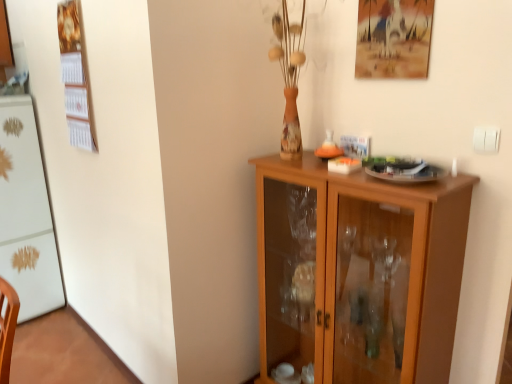
Question: From a real-world perspective, is white glossy refrigerator at left over wooden cabinet at center?

Choices:
 (A) yes
 (B) no

Answer: (A)

Question: From the image's perspective, is white glossy refrigerator at left located beneath wooden cabinet at center?

Choices:
 (A) no
 (B) yes

Answer: (A)

Question: Does white glossy refrigerator at left appear on the right side of wooden cabinet at center?

Choices:
 (A) no
 (B) yes

Answer: (A)

Question: Does white glossy refrigerator at left appear on the left side of wooden cabinet at center?

Choices:
 (A) yes
 (B) no

Answer: (A)

Question: Can you confirm if white glossy refrigerator at left is bigger than wooden cabinet at center?

Choices:
 (A) no
 (B) yes

Answer: (A)

Question: In the image, is matte wooden picture frame at upper right on the left side or the right side of wooden cabinet at center?

Choices:
 (A) left
 (B) right

Answer: (B)

Question: In the image, is matte wooden picture frame at upper right positioned in front of or behind wooden cabinet at center?

Choices:
 (A) behind
 (B) front

Answer: (A)

Question: From the image's perspective, relative to wooden cabinet at center, is matte wooden picture frame at upper right above or below?

Choices:
 (A) above
 (B) below

Answer: (A)

Question: From a real-world perspective, relative to wooden cabinet at center, is matte wooden picture frame at upper right vertically above or below?

Choices:
 (A) above
 (B) below

Answer: (A)

Question: Considering the positions of white glossy refrigerator at left and wooden cabinet at center in the image, is white glossy refrigerator at left wider or thinner than wooden cabinet at center?

Choices:
 (A) thin
 (B) wide

Answer: (B)

Question: Considering the positions of white glossy refrigerator at left and wooden cabinet at center in the image, is white glossy refrigerator at left taller or shorter than wooden cabinet at center?

Choices:
 (A) short
 (B) tall

Answer: (B)

Question: Is point (25, 130) closer or farther from the camera than point (379, 218)?

Choices:
 (A) farther
 (B) closer

Answer: (A)

Question: Choose the correct answer: Is white glossy refrigerator at left inside wooden cabinet at center or outside it?

Choices:
 (A) outside
 (B) inside

Answer: (A)

Question: In terms of size, does wooden cabinet at center appear bigger or smaller than white glossy refrigerator at left?

Choices:
 (A) small
 (B) big

Answer: (B)

Question: From the image's perspective, is wooden cabinet at center positioned above or below white glossy refrigerator at left?

Choices:
 (A) below
 (B) above

Answer: (A)